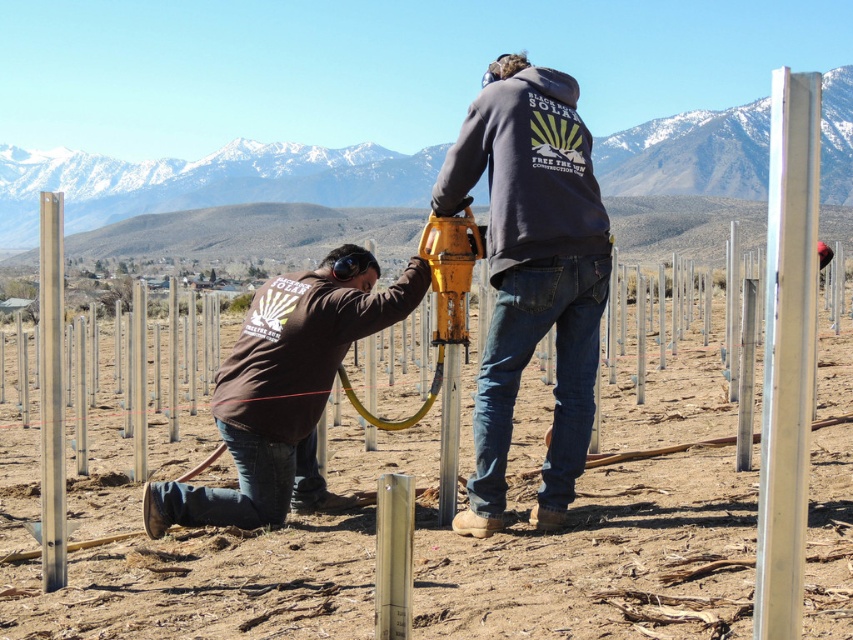
From the picture: Is brown dirt field at center positioned in front of polished silver pole at center?

Yes, brown dirt field at center is closer to the viewer.

This screenshot has height=640, width=853. What are the coordinates of `brown dirt field at center` in the screenshot? It's located at 421,538.

Is brown dirt field at center bigger than brown matte shirt at lower left?

Correct, brown dirt field at center is larger in size than brown matte shirt at lower left.

Does brown dirt field at center appear over brown matte shirt at lower left?

No, brown dirt field at center is not above brown matte shirt at lower left.

Is point (637, 410) positioned before point (349, 262)?

No, (637, 410) is behind (349, 262).

Find the location of a particular element. This screenshot has width=853, height=640. brown dirt field at center is located at coordinates (421, 538).

Does dark blue hoodie at center come in front of polished silver pole at center?

No.

Is dark blue hoodie at center to the left of polished silver pole at center from the viewer's perspective?

No, dark blue hoodie at center is not to the left of polished silver pole at center.

Who is more forward, (564,352) or (42,477)?

Point (42,477) is in front.

I want to click on dark blue hoodie at center, so click(531, 275).